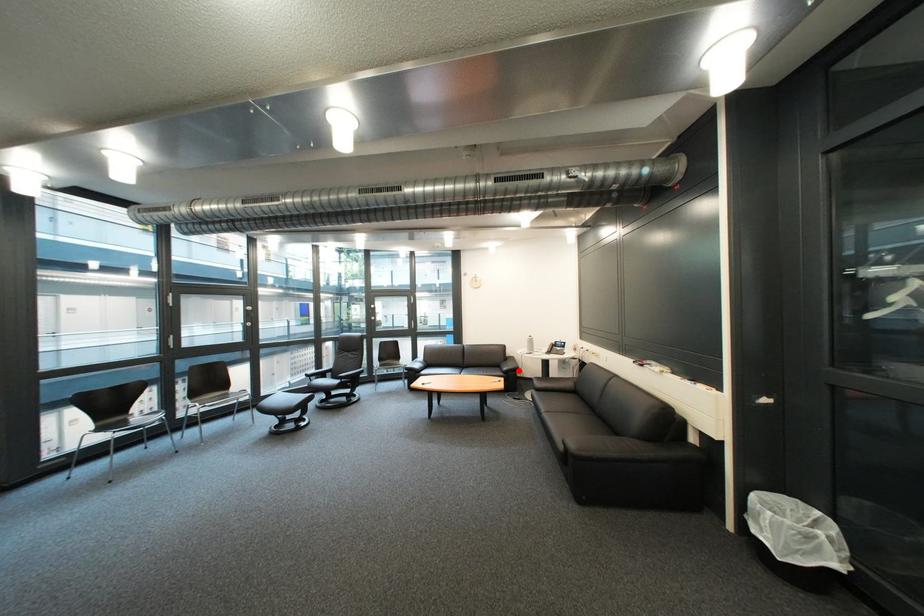
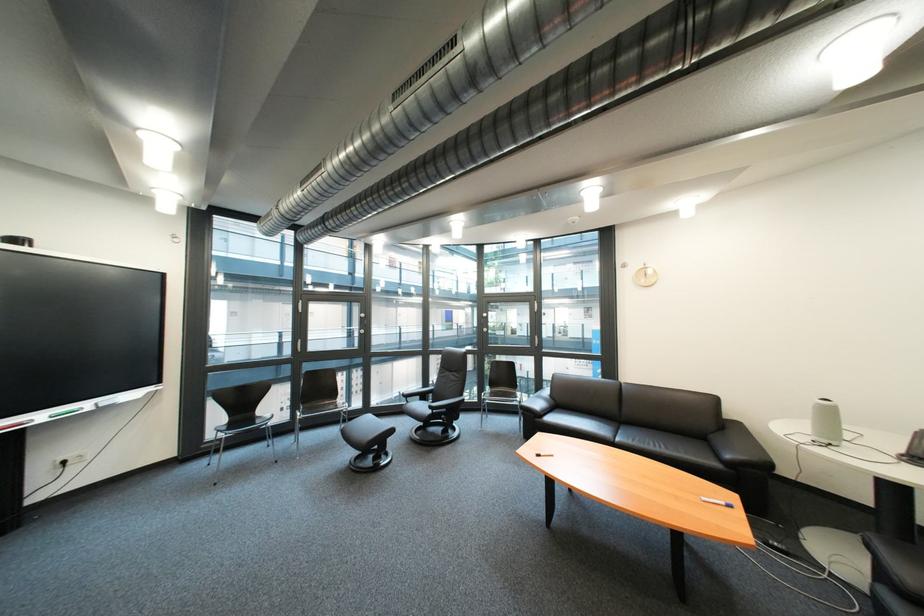
Question: A red point is marked in image1. In image2, is the corresponding 3D point closer to the camera or farther? Reply with the corresponding letter.

Choices:
 (A) The corresponding 3D point is closer.
 (B) The corresponding 3D point is farther.

Answer: (A)